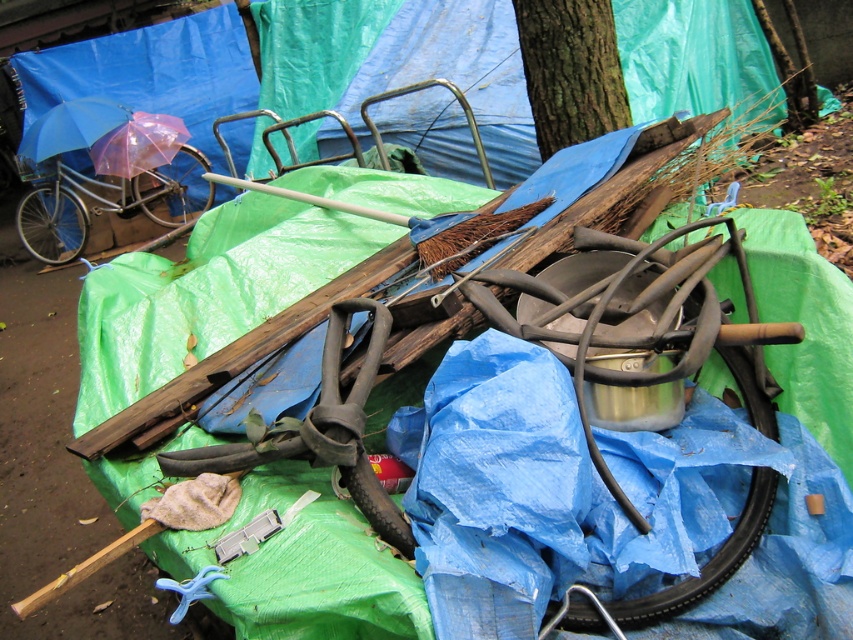
Who is lower down, transparent plastic umbrella at upper left or blue matte umbrella at upper left?

transparent plastic umbrella at upper left

Between point (135, 116) and point (45, 125), which one is positioned in front?

Point (45, 125) is more forward.

I want to click on transparent plastic umbrella at upper left, so click(138, 145).